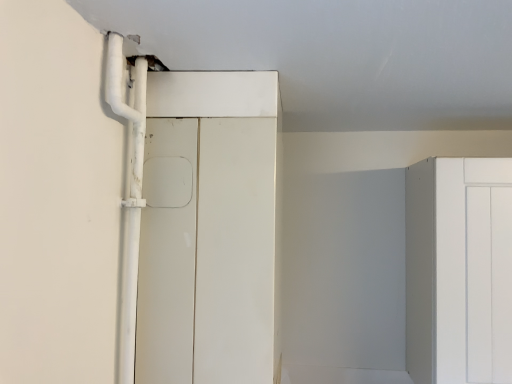
The image size is (512, 384). What are the coordinates of `white matte door at center` in the screenshot? It's located at (209, 229).

Describe the element at coordinates (209, 229) in the screenshot. I see `white matte door at center` at that location.

Image resolution: width=512 pixels, height=384 pixels. What do you see at coordinates (128, 191) in the screenshot? I see `white plastic pipe at left` at bounding box center [128, 191].

The height and width of the screenshot is (384, 512). What are the coordinates of `white plastic pipe at left` in the screenshot? It's located at (128, 191).

In order to face white plastic pipe at left, should I rotate leftwards or rightwards?

To face it directly, rotate left by 16.784 degrees.

Identify the location of white matte door at center. Image resolution: width=512 pixels, height=384 pixels. pos(209,229).

Is white plastic pipe at left to the left of white matte door at center from the viewer's perspective?

Correct, you'll find white plastic pipe at left to the left of white matte door at center.

Who is more distant, white plastic pipe at left or white matte door at center?

white matte door at center.

Which is closer to the camera, (130, 287) or (192, 77)?

Point (130, 287) appears to be closer to the viewer than point (192, 77).

From the image's perspective, which object appears higher, white plastic pipe at left or white matte door at center?

From the image's view, white plastic pipe at left is above.

From a real-world perspective, is white plastic pipe at left located higher than white matte door at center?

Yes.

Is white plastic pipe at left thinner than white matte door at center?

Correct, the width of white plastic pipe at left is less than that of white matte door at center.

Looking at this image, from their relative heights in the image, would you say white plastic pipe at left is taller or shorter than white matte door at center?

Considering their sizes, white plastic pipe at left has less height than white matte door at center.

Can you confirm if white plastic pipe at left is smaller than white matte door at center?

Indeed, white plastic pipe at left has a smaller size compared to white matte door at center.

Do you think white plastic pipe at left is within white matte door at center, or outside of it?

white plastic pipe at left is located beyond the bounds of white matte door at center.

Are white plastic pipe at left and white matte door at center far apart?

No.

Is white plastic pipe at left looking in the opposite direction of white matte door at center?

white plastic pipe at left does not have its back to white matte door at center.

How many degrees apart are the facing directions of white plastic pipe at left and white matte door at center?

0.0102 degrees.

At what (x,y) coordinates should I click in order to perform the action: click on pipe lying on the left of white matte door at center. Please return your answer as a coordinate pair (x, y). This screenshot has height=384, width=512. Looking at the image, I should click on (128, 191).

Between white matte door at center and white plastic pipe at left, which one appears on the right side from the viewer's perspective?

white matte door at center.

Relative to white plastic pipe at left, is white matte door at center in front or behind?

white matte door at center is positioned farther from the viewer than white plastic pipe at left.

Is point (258, 315) closer or farther from the camera than point (131, 254)?

Clearly, point (258, 315) is more distant from the camera than point (131, 254).

From the image's perspective, which one is positioned lower, white matte door at center or white plastic pipe at left?

white matte door at center, from the image's perspective.

From a real-world perspective, which is physically above, white matte door at center or white plastic pipe at left?

From a 3D spatial view, white plastic pipe at left is above.

Which of these two, white matte door at center or white plastic pipe at left, is wider?

white matte door at center.

In terms of height, does white matte door at center look taller or shorter compared to white plastic pipe at left?

white matte door at center is taller than white plastic pipe at left.

In terms of size, does white matte door at center appear bigger or smaller than white plastic pipe at left?

In the image, white matte door at center appears to be larger than white plastic pipe at left.

In the scene shown: Is white plastic pipe at left a part of white matte door at center?

That's incorrect, white plastic pipe at left is not inside white matte door at center.

Are white matte door at center and white plastic pipe at left located far from each other?

No, white matte door at center is in close proximity to white plastic pipe at left.

Does white matte door at center turn towards white plastic pipe at left?

No, white matte door at center is not aimed at white plastic pipe at left.

Find the location of a particular element. door located below the white plastic pipe at left (from the image's perspective) is located at coordinates (209, 229).

This screenshot has width=512, height=384. Find the location of `pipe above the white matte door at center (from a real-world perspective)`. pipe above the white matte door at center (from a real-world perspective) is located at coordinates (128, 191).

Identify the location of pipe above the white matte door at center (from the image's perspective). This screenshot has width=512, height=384. (128, 191).